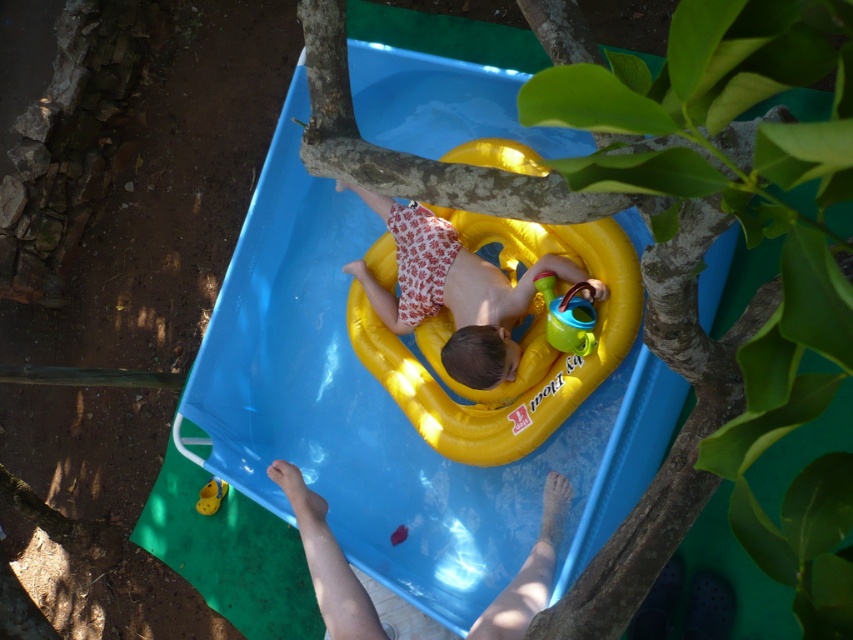
Can you confirm if blue plastic slide at center is positioned above yellow rubber ring at center?

Actually, blue plastic slide at center is below yellow rubber ring at center.

Image resolution: width=853 pixels, height=640 pixels. In order to click on blue plastic slide at center in this screenshot , I will do 392,412.

Locate an element on the screen. This screenshot has height=640, width=853. blue plastic slide at center is located at coordinates (392, 412).